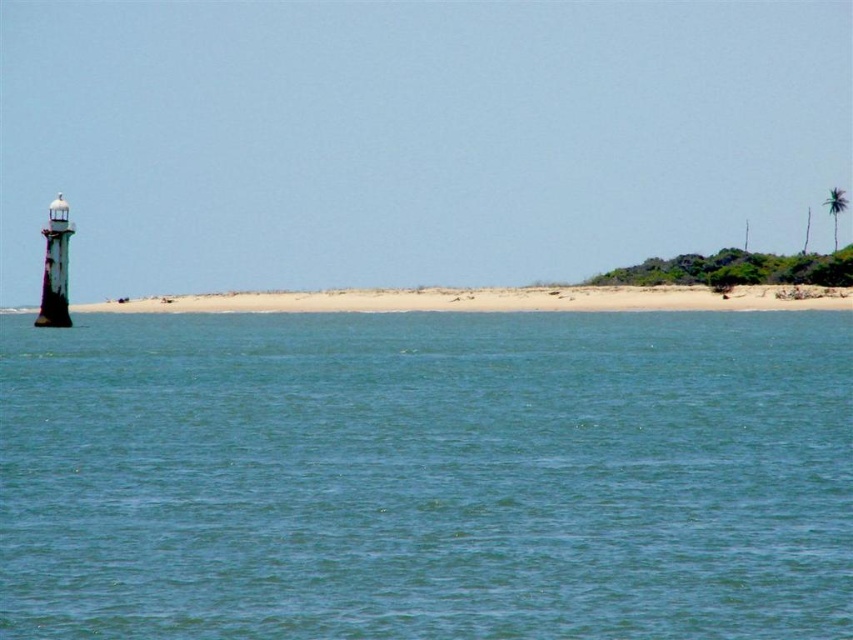
Question: Which point is farther to the camera?

Choices:
 (A) (233, 310)
 (B) (200, 496)

Answer: (A)

Question: Which object appears farthest from the camera in this image?

Choices:
 (A) blue water at center
 (B) beige sand beach at center

Answer: (B)

Question: Does blue water at center have a greater width compared to beige sand beach at center?

Choices:
 (A) no
 (B) yes

Answer: (A)

Question: Does blue water at center appear on the right side of beige sand beach at center?

Choices:
 (A) yes
 (B) no

Answer: (A)

Question: Can you confirm if blue water at center is smaller than beige sand beach at center?

Choices:
 (A) yes
 (B) no

Answer: (B)

Question: Which point is farther from the camera taking this photo?

Choices:
 (A) (813, 451)
 (B) (717, 301)

Answer: (B)